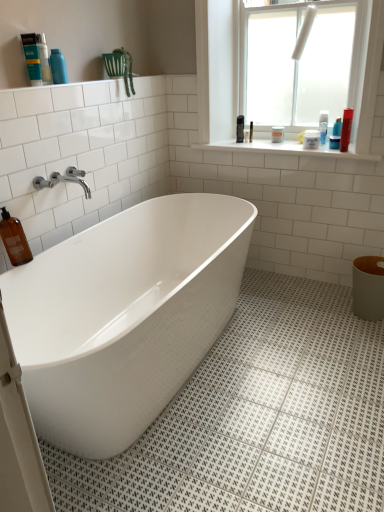
Question: Can you confirm if chrome metallic faucet at upper left is positioned to the right of blue glossy bottle at upper left, the fifth toiletry when ordered from right to left?

Choices:
 (A) no
 (B) yes

Answer: (B)

Question: Is chrome metallic faucet at upper left turned away from blue glossy bottle at upper left, marked as the 5th toiletry in a back-to-front arrangement?

Choices:
 (A) yes
 (B) no

Answer: (B)

Question: Does chrome metallic faucet at upper left have a larger size compared to blue glossy bottle at upper left, which is counted as the 1th toiletry, starting from the front?

Choices:
 (A) no
 (B) yes

Answer: (B)

Question: From a real-world perspective, is chrome metallic faucet at upper left below blue glossy bottle at upper left, arranged as the 1th toiletry when viewed from the left?

Choices:
 (A) yes
 (B) no

Answer: (A)

Question: Is chrome metallic faucet at upper left aimed at blue glossy bottle at upper left, marked as the 5th toiletry in a back-to-front arrangement?

Choices:
 (A) no
 (B) yes

Answer: (A)

Question: From a real-world perspective, is blue glossy lotion at upper right, the 5th toiletry when ordered from left to right, physically located above or below shiny plastic bottle at upper right, marked as the third cleaning product in a top-to-bottom arrangement?

Choices:
 (A) below
 (B) above

Answer: (A)

Question: Is point (337, 126) positioned closer to the camera than point (349, 118)?

Choices:
 (A) farther
 (B) closer

Answer: (A)

Question: Considering their positions, is blue glossy lotion at upper right, positioned as the 4th toiletry in front-to-back order, located in front of or behind shiny plastic bottle at upper right, the 4th cleaning product viewed from the left?

Choices:
 (A) behind
 (B) front

Answer: (A)

Question: Considering the positions of blue glossy lotion at upper right, positioned as the 4th toiletry in front-to-back order, and shiny plastic bottle at upper right, the 4th cleaning product viewed from the left, in the image, is blue glossy lotion at upper right, positioned as the 4th toiletry in front-to-back order, taller or shorter than shiny plastic bottle at upper right, the 4th cleaning product viewed from the left,?

Choices:
 (A) tall
 (B) short

Answer: (B)

Question: In terms of width, does white frosted glass window at upper right look wider or thinner when compared to white matte jar at upper right, acting as the third toiletry starting from the right?

Choices:
 (A) thin
 (B) wide

Answer: (A)

Question: Considering the positions of white frosted glass window at upper right and white matte jar at upper right, which is the third toiletry from back to front, in the image, is white frosted glass window at upper right taller or shorter than white matte jar at upper right, which is the third toiletry from back to front,?

Choices:
 (A) short
 (B) tall

Answer: (B)

Question: From a real-world perspective, is white frosted glass window at upper right physically located above or below white matte jar at upper right, placed as the third toiletry when sorted from left to right?

Choices:
 (A) below
 (B) above

Answer: (B)

Question: Based on their sizes in the image, would you say white frosted glass window at upper right is bigger or smaller than white matte jar at upper right, placed as the third toiletry when sorted from left to right?

Choices:
 (A) small
 (B) big

Answer: (B)

Question: Would you say brown glass bottle at lower left, acting as the first cleaning product starting from the left, is to the left or to the right of matte blue bottle at upper left, the 3th cleaning product positioned from the front, in the picture?

Choices:
 (A) right
 (B) left

Answer: (B)

Question: From the image's perspective, is brown glass bottle at lower left, the first cleaning product viewed from the front, above or below matte blue bottle at upper left, the second cleaning product in the right-to-left sequence?

Choices:
 (A) above
 (B) below

Answer: (B)